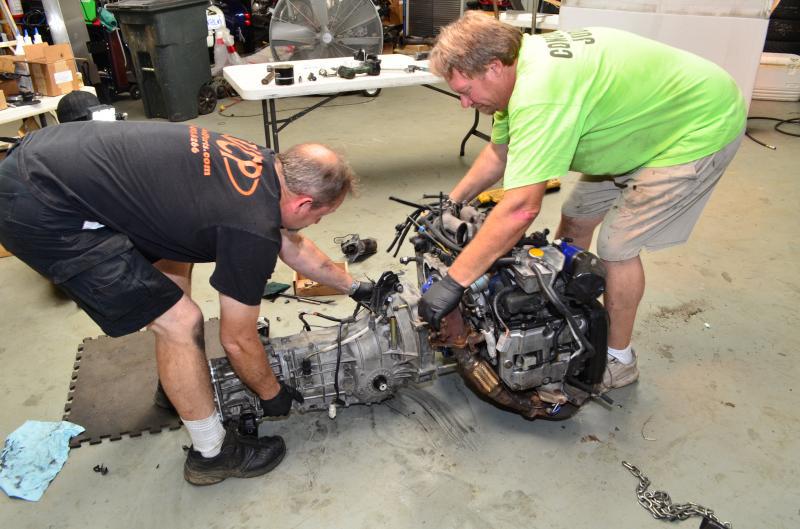
Where is `garbage can`? The image size is (800, 529). garbage can is located at coordinates (182, 37).